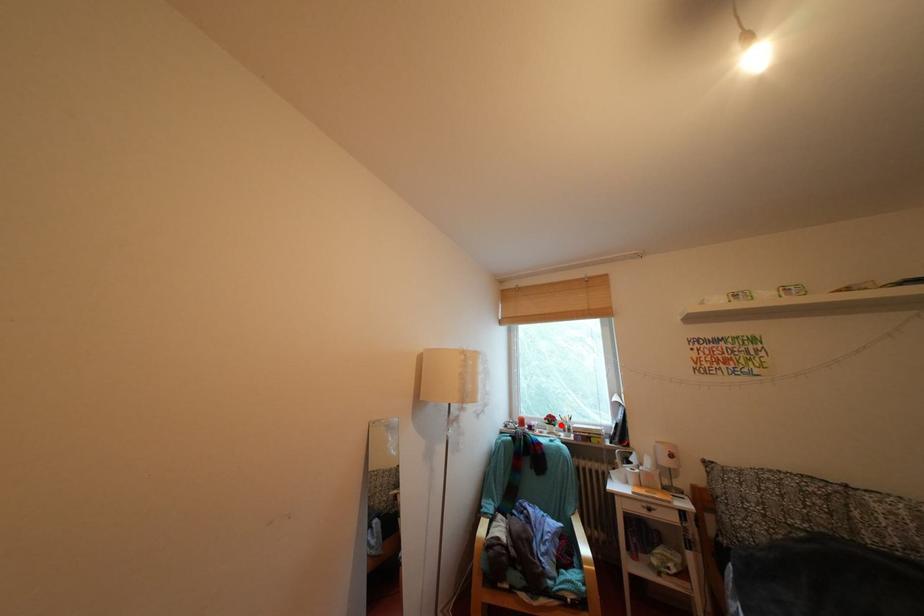
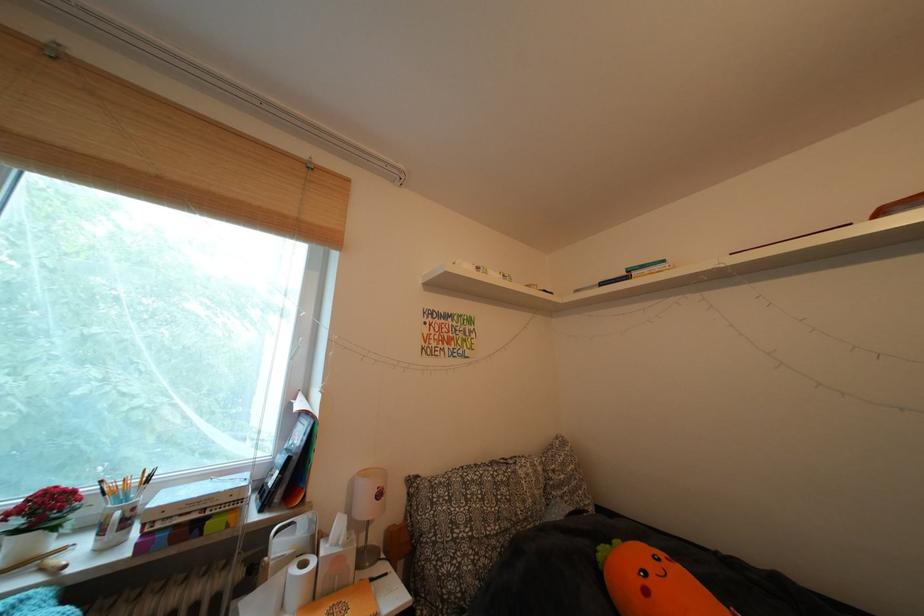
Question: I am providing you with two images of the same scene from different viewpoints. A red point is shown in image1. For the corresponding object point in image2, is it positioned nearer or farther from the camera?

Choices:
 (A) Nearer
 (B) Farther

Answer: (A)